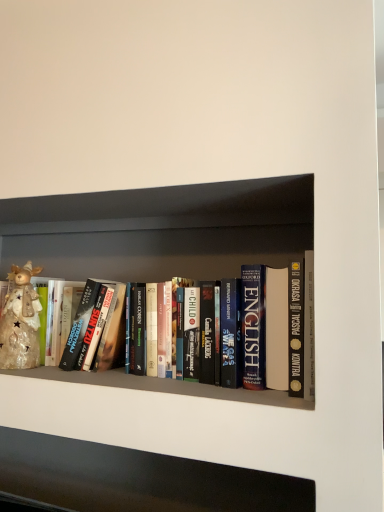
Question: Looking at the image, does shiny metallic reindeer at left seem bigger or smaller compared to hardcover books at center?

Choices:
 (A) small
 (B) big

Answer: (A)

Question: In terms of width, does shiny metallic reindeer at left look wider or thinner when compared to hardcover books at center?

Choices:
 (A) wide
 (B) thin

Answer: (B)

Question: From a real-world perspective, relative to hardcover books at center, is shiny metallic reindeer at left vertically above or below?

Choices:
 (A) above
 (B) below

Answer: (B)

Question: Visually, is hardcover books at center positioned to the left or to the right of shiny metallic reindeer at left?

Choices:
 (A) left
 (B) right

Answer: (B)

Question: Does point (137, 268) appear closer or farther from the camera than point (1, 325)?

Choices:
 (A) closer
 (B) farther

Answer: (B)

Question: Based on their sizes in the image, would you say hardcover books at center is bigger or smaller than shiny metallic reindeer at left?

Choices:
 (A) small
 (B) big

Answer: (B)

Question: From the image's perspective, is hardcover books at center above or below shiny metallic reindeer at left?

Choices:
 (A) below
 (B) above

Answer: (B)